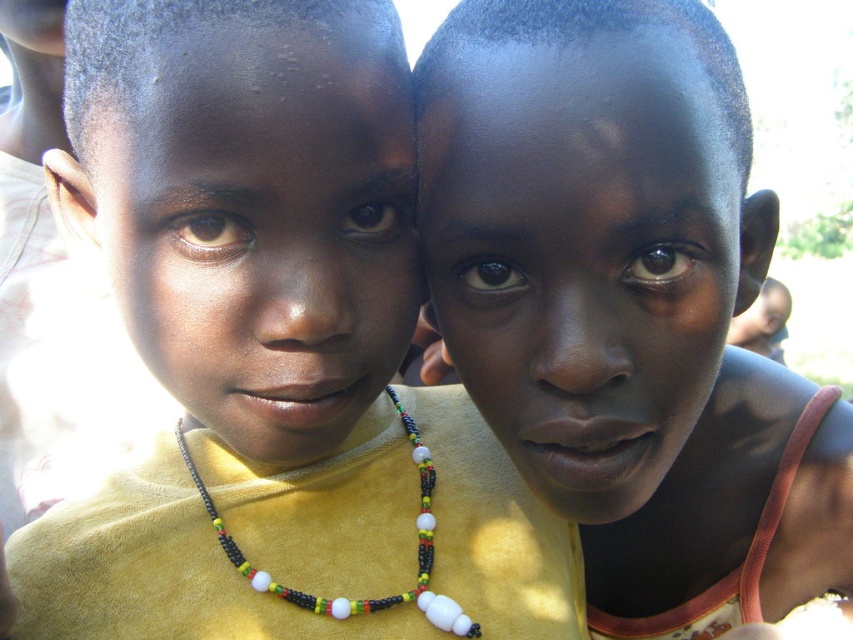
This screenshot has height=640, width=853. What are the coordinates of `yellow matte shirt at center` in the screenshot? It's located at (274, 349).

Does yellow matte shirt at center have a greater height compared to yellow fabric shirt at center?

Yes.

I want to click on yellow matte shirt at center, so click(274, 349).

Is yellow fabric shirt at center shorter than beaded necklace at center?

No.

Which is behind, point (589, 524) or point (415, 461)?

Point (589, 524)

Is point (595, 3) positioned before point (428, 492)?

Yes, it is in front of point (428, 492).

In order to click on yellow fabric shirt at center in this screenshot , I will do `click(625, 307)`.

What do you see at coordinates (274, 349) in the screenshot? I see `yellow matte shirt at center` at bounding box center [274, 349].

Is point (207, 506) farther from viewer compared to point (241, 552)?

Yes, it is.

Locate an element on the screen. This screenshot has width=853, height=640. yellow matte shirt at center is located at coordinates (274, 349).